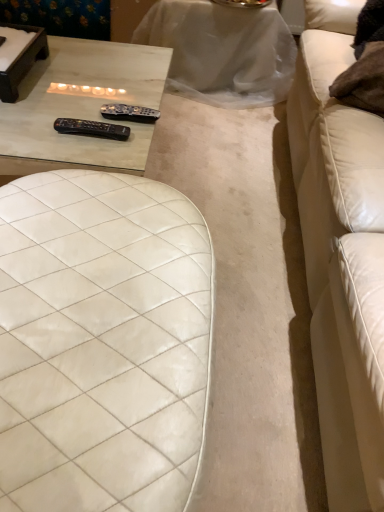
Describe the element at coordinates (92, 129) in the screenshot. I see `black plastic remote at center, positioned as the 1th remote in front-to-back order` at that location.

How much space does black plastic remote at upper center, acting as the 2th remote starting from the front, occupy horizontally?

3.05 inches.

Describe the element at coordinates (81, 106) in the screenshot. Image resolution: width=384 pixels, height=512 pixels. I see `matte glass table at upper left, positioned as the first table in front-to-back order` at that location.

In order to face white marble table at upper center, positioned as the second table in bottom-to-top order, should I rotate leftwards or rightwards?

Turn right by 3.153 degrees to look at white marble table at upper center, positioned as the second table in bottom-to-top order.

The image size is (384, 512). Describe the element at coordinates (222, 51) in the screenshot. I see `white marble table at upper center, which ranks as the second table in front-to-back order` at that location.

Locate an element on the screen. This screenshot has width=384, height=512. black plastic remote at center, which appears as the 2th remote when viewed from the back is located at coordinates (92, 129).

Between black plastic remote at upper center, acting as the 2th remote starting from the front, and white marble table at upper center, placed as the 1th table when sorted from back to front, which one has more height?

white marble table at upper center, placed as the 1th table when sorted from back to front.

Is black plastic remote at upper center, acting as the 2th remote starting from the front, behind white marble table at upper center, placed as the 1th table when sorted from back to front?

No, black plastic remote at upper center, acting as the 2th remote starting from the front, is closer to the camera.

Based on the photo, which is more to the right, black plastic remote at upper center, marked as the first remote in a back-to-front arrangement, or white marble table at upper center, placed as the 1th table when sorted from top to bottom?

white marble table at upper center, placed as the 1th table when sorted from top to bottom, is more to the right.

Does matte glass table at upper left, which is counted as the second table, starting from the top, turn towards white leather couch at right?

No, matte glass table at upper left, which is counted as the second table, starting from the top, is not oriented towards white leather couch at right.

This screenshot has height=512, width=384. In order to click on table that is the 2nd object to the left of the white leather couch at right, starting at the anchor in this screenshot , I will do `click(81, 106)`.

Who is bigger, matte glass table at upper left, which ranks as the first table in bottom-to-top order, or white leather couch at right?

white leather couch at right.

From the image's perspective, is matte glass table at upper left, positioned as the first table in front-to-back order, over white leather couch at right?

Yes, from the image's perspective, matte glass table at upper left, positioned as the first table in front-to-back order, is on top of white leather couch at right.

Measure the distance from white leather couch at right to white quilted leather ottoman at center.

21.81 inches.

Is point (362, 360) positioned in front of point (76, 327)?

Yes, point (362, 360) is in front of point (76, 327).

Considering the relative sizes of white leather couch at right and white quilted leather ottoman at center in the image provided, is white leather couch at right shorter than white quilted leather ottoman at center?

No.

Could you tell me if matte glass table at upper left, which ranks as the first table in bottom-to-top order, is turned towards black plastic remote at upper center, marked as the first remote in a back-to-front arrangement?

No, matte glass table at upper left, which ranks as the first table in bottom-to-top order, is not turned towards black plastic remote at upper center, marked as the first remote in a back-to-front arrangement.

Is matte glass table at upper left, which ranks as the first table in bottom-to-top order, positioned behind black plastic remote at upper center, acting as the 2th remote starting from the front?

No, it is in front of black plastic remote at upper center, acting as the 2th remote starting from the front.

From a real-world perspective, is matte glass table at upper left, which ranks as the first table in bottom-to-top order, under black plastic remote at upper center, acting as the 2th remote starting from the front?

Correct, in the physical world, matte glass table at upper left, which ranks as the first table in bottom-to-top order, is lower than black plastic remote at upper center, acting as the 2th remote starting from the front.

What's the angular difference between white leather couch at right and black plastic remote at upper center, marked as the first remote in a back-to-front arrangement,'s facing directions?

The facing directions of white leather couch at right and black plastic remote at upper center, marked as the first remote in a back-to-front arrangement, are 85.1 degrees apart.

Is white leather couch at right positioned with its back to black plastic remote at upper center, marked as the first remote in a back-to-front arrangement?

That's right, white leather couch at right is facing away from black plastic remote at upper center, marked as the first remote in a back-to-front arrangement.

Can we say white leather couch at right lies outside black plastic remote at upper center, marked as the first remote in a back-to-front arrangement?

Absolutely, white leather couch at right is external to black plastic remote at upper center, marked as the first remote in a back-to-front arrangement.

Does white leather couch at right lie in front of black plastic remote at upper center, acting as the 2th remote starting from the front?

Yes, it is.

Does white marble table at upper center, positioned as the second table in bottom-to-top order, have a larger size compared to white leather couch at right?

Incorrect, white marble table at upper center, positioned as the second table in bottom-to-top order, is not larger than white leather couch at right.

I want to click on studio couch above the white marble table at upper center, placed as the 1th table when sorted from top to bottom (from a real-world perspective), so click(341, 255).

Looking at their sizes, would you say white marble table at upper center, which ranks as the second table in front-to-back order, is wider or thinner than white leather couch at right?

Considering their sizes, white marble table at upper center, which ranks as the second table in front-to-back order, looks broader than white leather couch at right.

From the image's perspective, which one is positioned lower, black plastic remote at upper center, marked as the first remote in a back-to-front arrangement, or black plastic remote at center, positioned as the 1th remote in front-to-back order?

From the image's view, black plastic remote at center, positioned as the 1th remote in front-to-back order, is below.

Considering the relative positions of black plastic remote at upper center, acting as the 2th remote starting from the front, and black plastic remote at center, positioned as the 1th remote in front-to-back order, in the image provided, is black plastic remote at upper center, acting as the 2th remote starting from the front, to the left of black plastic remote at center, positioned as the 1th remote in front-to-back order, from the viewer's perspective?

No.

Would you say black plastic remote at upper center, marked as the first remote in a back-to-front arrangement, contains black plastic remote at center, which appears as the 2th remote when viewed from the back?

No, black plastic remote at center, which appears as the 2th remote when viewed from the back, is located outside of black plastic remote at upper center, marked as the first remote in a back-to-front arrangement.

Which of these two, black plastic remote at upper center, marked as the first remote in a back-to-front arrangement, or black plastic remote at center, positioned as the 1th remote in front-to-back order, is bigger?

With larger size is black plastic remote at upper center, marked as the first remote in a back-to-front arrangement.

Where is `table on the right of black plastic remote at upper center, marked as the first remote in a back-to-front arrangement`? This screenshot has height=512, width=384. table on the right of black plastic remote at upper center, marked as the first remote in a back-to-front arrangement is located at coordinates (222, 51).

Where is `the 1st table behind the white leather couch at right, counting from the anchor's position`? The image size is (384, 512). the 1st table behind the white leather couch at right, counting from the anchor's position is located at coordinates (81, 106).

Looking at the image, which one is located further to matte glass table at upper left, which is counted as the second table, starting from the top, white quilted leather ottoman at center or black plastic remote at center, which appears as the 2th remote when viewed from the back?

white quilted leather ottoman at center is further to matte glass table at upper left, which is counted as the second table, starting from the top.

Which object lies nearer to the anchor point white leather couch at right, white quilted leather ottoman at center or matte glass table at upper left, positioned as the first table in front-to-back order?

The object closer to white leather couch at right is white quilted leather ottoman at center.

From the image, which object appears to be nearer to white quilted leather ottoman at center, black plastic remote at center, which appears as the 2th remote when viewed from the back, or matte glass table at upper left, positioned as the first table in front-to-back order?

matte glass table at upper left, positioned as the first table in front-to-back order, is positioned closer to the anchor white quilted leather ottoman at center.

When comparing their distances from white quilted leather ottoman at center, does white leather couch at right or black plastic remote at upper center, acting as the 2th remote starting from the front, seem further?

Among the two, black plastic remote at upper center, acting as the 2th remote starting from the front, is located further to white quilted leather ottoman at center.

Based on their spatial positions, is black plastic remote at upper center, acting as the 2th remote starting from the front, or black plastic remote at center, positioned as the 1th remote in front-to-back order, closer to white marble table at upper center, which ranks as the second table in front-to-back order?

black plastic remote at upper center, acting as the 2th remote starting from the front.

Estimate the real-world distances between objects in this image. Which object is further from white leather couch at right, matte glass table at upper left, the second table viewed from the back, or white quilted leather ottoman at center?

Based on the image, matte glass table at upper left, the second table viewed from the back, appears to be further to white leather couch at right.

When comparing their distances from white leather couch at right, does white marble table at upper center, which ranks as the second table in front-to-back order, or matte glass table at upper left, positioned as the first table in front-to-back order, seem further?

matte glass table at upper left, positioned as the first table in front-to-back order.

From the image, which object appears to be farther from black plastic remote at center, positioned as the 1th remote in front-to-back order, black plastic remote at upper center, acting as the 2th remote starting from the front, or white leather couch at right?

white leather couch at right is further to black plastic remote at center, positioned as the 1th remote in front-to-back order.

This screenshot has height=512, width=384. In order to click on remote between white quilted leather ottoman at center and black plastic remote at upper center, acting as the 2th remote starting from the front, from front to back in this screenshot , I will do `click(92, 129)`.

Where is `remote between matte glass table at upper left, positioned as the first table in front-to-back order, and white quilted leather ottoman at center, in the vertical direction`? remote between matte glass table at upper left, positioned as the first table in front-to-back order, and white quilted leather ottoman at center, in the vertical direction is located at coordinates (92, 129).

This screenshot has width=384, height=512. Find the location of `table between black plastic remote at upper center, acting as the 2th remote starting from the front, and white quilted leather ottoman at center from top to bottom`. table between black plastic remote at upper center, acting as the 2th remote starting from the front, and white quilted leather ottoman at center from top to bottom is located at coordinates (81, 106).

Locate an element on the screen. furniture between white leather couch at right and white marble table at upper center, positioned as the second table in bottom-to-top order, from front to back is located at coordinates (102, 343).